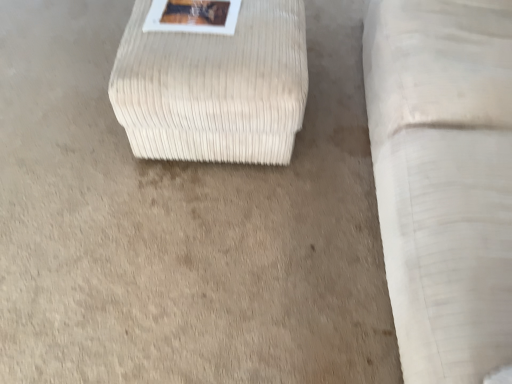
Find the location of a particular element. This screenshot has height=384, width=512. white corduroy ottoman at center is located at coordinates click(x=214, y=87).

In order to face white corduroy ottoman at center, should I rotate leftwards or rightwards?

You should look left and rotate roughly 5.443 degrees.

Describe the element at coordinates (214, 87) in the screenshot. I see `white corduroy ottoman at center` at that location.

What is the approximate width of white corduroy ottoman at center?

white corduroy ottoman at center is 25.45 inches wide.

This screenshot has width=512, height=384. I want to click on white corduroy ottoman at center, so click(x=214, y=87).